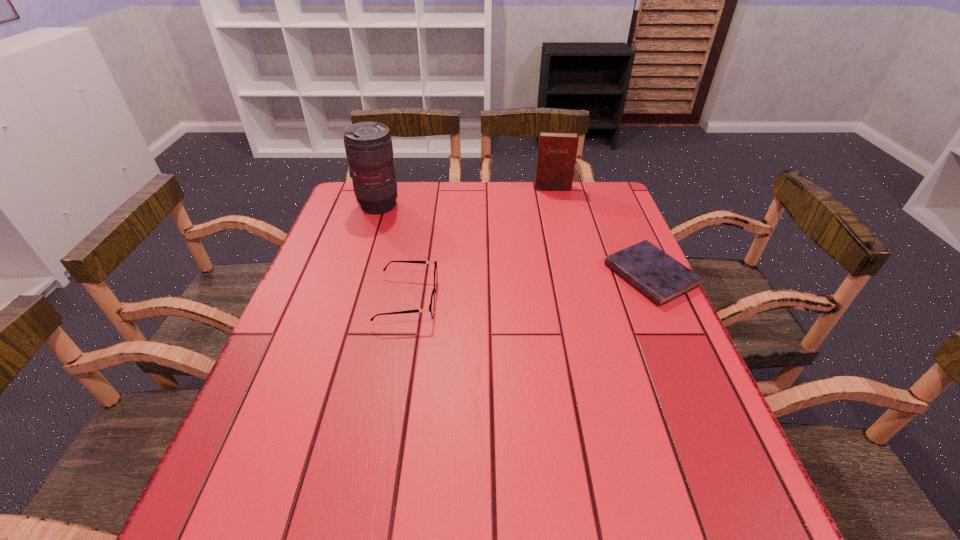
In order to click on free space between the second object from right to left and the third object from right to left in this screenshot , I will do `click(480, 244)`.

Locate an element on the screen. unoccupied area between the spectacles and the shorter diary is located at coordinates (529, 288).

This screenshot has width=960, height=540. In order to click on free space between the farthest object and the second farthest object in this screenshot , I will do `click(466, 197)`.

You are a GUI agent. You are given a task and a screenshot of the screen. Output one action in this format:
    pyautogui.click(x=<x>, y=<y>)
    Task: Click on the free space between the left diary and the tallest object
    The width and height of the screenshot is (960, 540).
    Given the screenshot: What is the action you would take?
    pyautogui.click(x=466, y=197)

The width and height of the screenshot is (960, 540). I want to click on free space that is in between the second farthest object and the shortest object, so click(x=515, y=241).

Locate an element on the screen. This screenshot has height=540, width=960. free spot between the second object from left to right and the third nearest object is located at coordinates (393, 253).

Locate which object ranks in proximity to the right diary. Please provide its 2D coordinates. Your answer should be formatted as a tuple, i.e. [(x, y)], where the tuple contains the x and y coordinates of a point satisfying the conditions above.

[(557, 151)]

Find the location of `the third closest object to the second shortest object`. the third closest object to the second shortest object is located at coordinates (557, 151).

Image resolution: width=960 pixels, height=540 pixels. I want to click on vacant area that satisfies the following two spatial constraints: 1. on the front side of the tallest object; 2. on the front-facing side of the third tallest object, so click(x=348, y=300).

You are a GUI agent. You are given a task and a screenshot of the screen. Output one action in this format:
    pyautogui.click(x=<x>, y=<y>)
    Task: Click on the vacant area in the image that satisfies the following two spatial constraints: 1. on the front side of the tallest object; 2. on the front-facing side of the third object from right to left
    
    Given the screenshot: What is the action you would take?
    pyautogui.click(x=348, y=300)